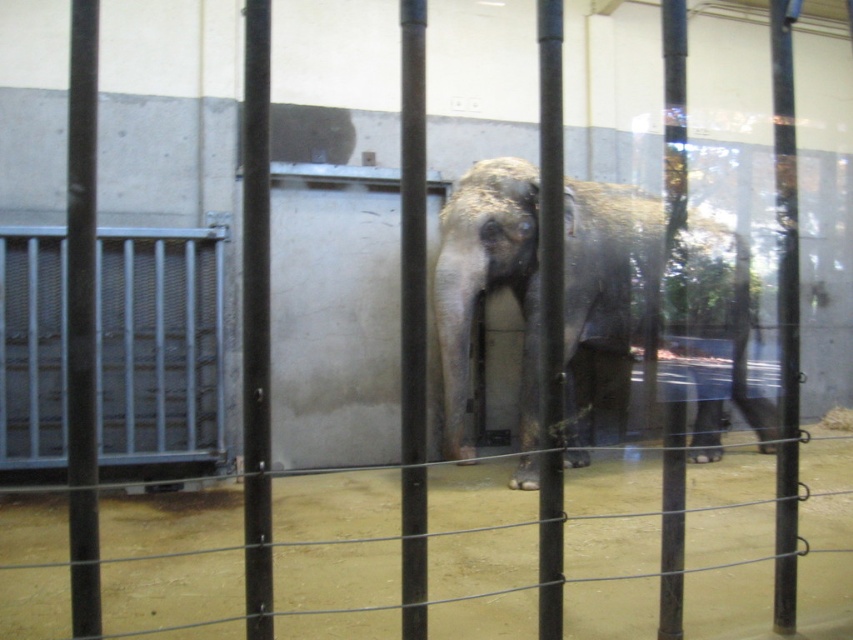
You are standing in front of the enclosure and want to take a photo of the elephant. You notice two points marked in the image. One is at coordinate point (486, 221) and the other is at point (99, 369). Which point is closer to your camera position?

Point (486, 221) is closer to the camera than point (99, 369).

You are standing outside the enclosure and want to take a photo of the gray textured elephant at center without the brushed metal gate at left appearing in the frame. Which side of the elephant should you position yourself to achieve this?

You should position yourself to the right side of the gray textured elephant at center because it is positioned on the right side of the brushed metal gate at left, so moving to the right side of the elephant would place the gate out of the frame.

You are a zookeeper who needs to feed the elephant. The food is placed near the brushed metal gate at left. Can you safely reach the food without getting too close to the gray textured elephant at center?

The distance between the gray textured elephant at center and the brushed metal gate at left is 1.66 meters. Since the food is near the gate, you can safely reach it as the distance is sufficient to avoid the elephant.